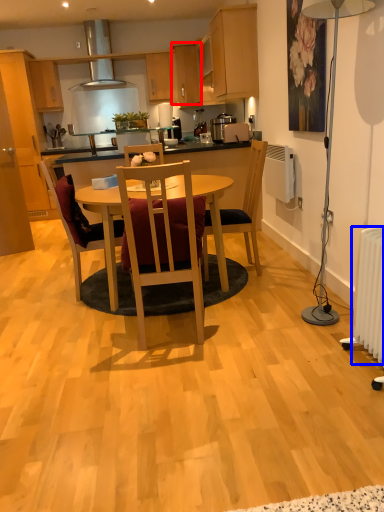
Question: Among these objects, which one is nearest to the camera, cabinetry (highlighted by a red box) or radiator (highlighted by a blue box)?

Choices:
 (A) cabinetry
 (B) radiator

Answer: (B)